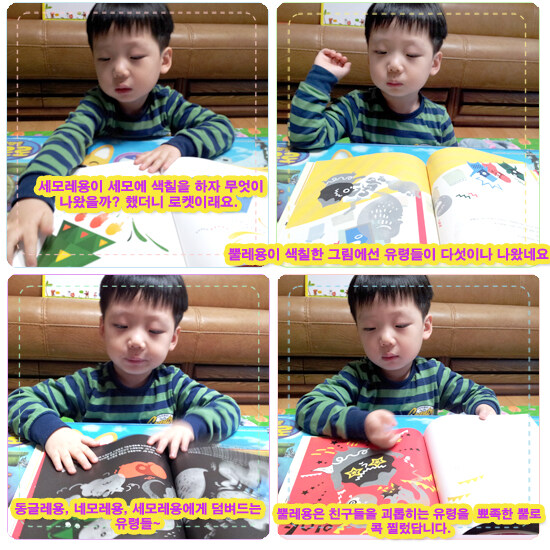
The image size is (550, 550). Find the location of `brown couch`. brown couch is located at coordinates (513, 335), (185, 318), (216, 47), (510, 62).